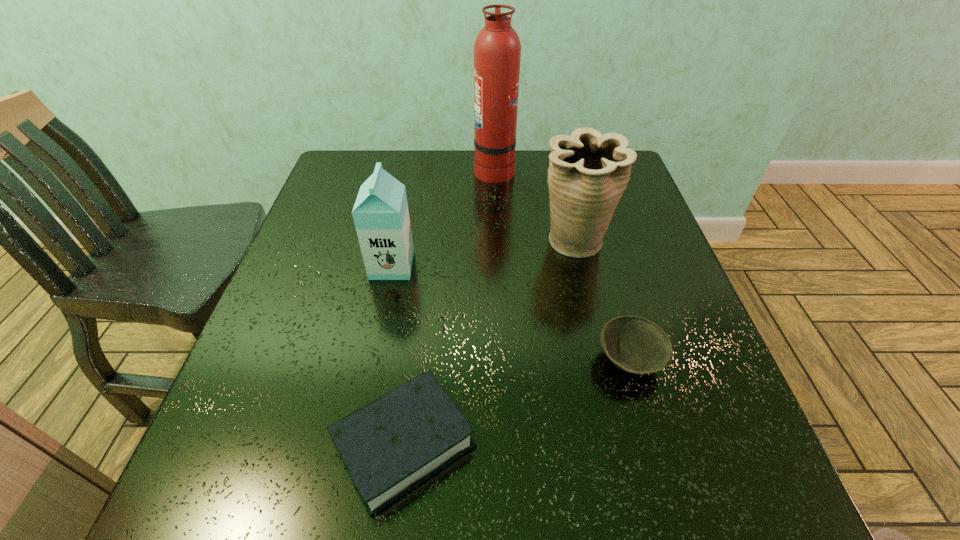
Where is `free space located 0.190m on the front of the milk carton`? The image size is (960, 540). free space located 0.190m on the front of the milk carton is located at coordinates (374, 351).

Image resolution: width=960 pixels, height=540 pixels. I want to click on vacant region located 0.100m on the front of the bowl, so click(x=653, y=444).

Identify the location of vacant space located 0.350m on the back of the Bible. (428, 252).

Image resolution: width=960 pixels, height=540 pixels. I want to click on object positioned at the far edge, so click(x=497, y=49).

In order to click on object that is at the near edge in this screenshot , I will do click(392, 444).

What are the coordinates of `urn that is at the right edge` in the screenshot? It's located at (588, 172).

Find the location of a particular element. The image size is (960, 540). bowl situated at the right edge is located at coordinates (634, 344).

This screenshot has width=960, height=540. Identify the location of free region at the far edge. (437, 166).

The height and width of the screenshot is (540, 960). I want to click on blank space at the near edge of the desktop, so click(527, 476).

Where is `vacant region at the left edge`? The width and height of the screenshot is (960, 540). vacant region at the left edge is located at coordinates (350, 292).